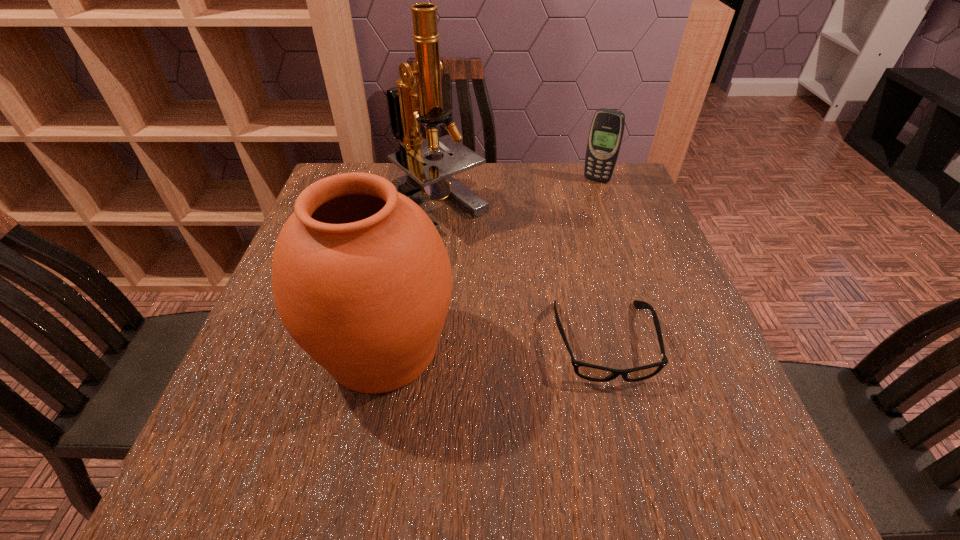
Locate an element on the screen. vacant space on the desktop that is between the urn and the spectacles and is positioned on the screen of the cellular telephone is located at coordinates (503, 345).

You are a GUI agent. You are given a task and a screenshot of the screen. Output one action in this format:
    pyautogui.click(x=<x>, y=<y>)
    Task: Click on the free spot on the desktop that is between the second tallest object and the shortest object and is positioned at the eyepiece of the microscope
    The height and width of the screenshot is (540, 960).
    Given the screenshot: What is the action you would take?
    pyautogui.click(x=480, y=346)